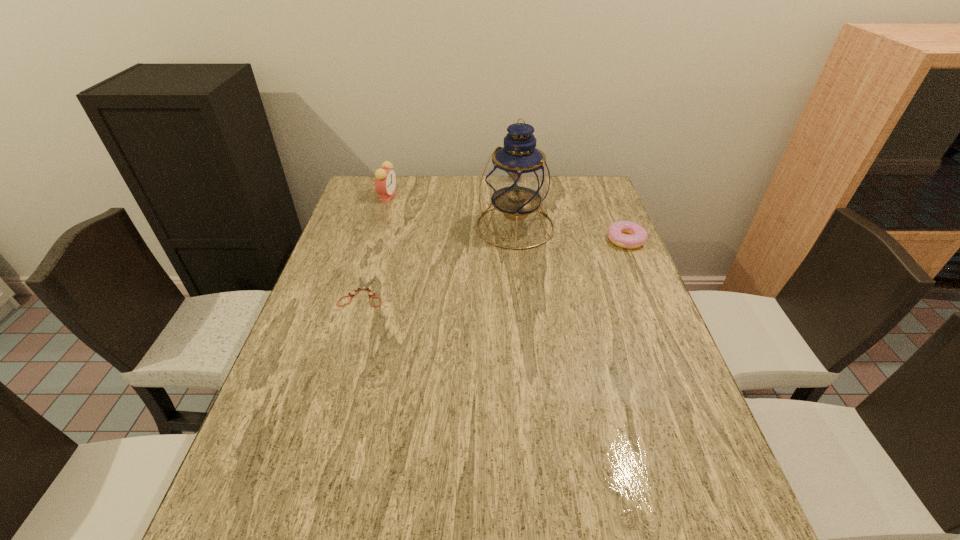
At what (x,y) coordinates should I click in order to perform the action: click on free spot between the rightmost object and the nearest object. Please return your answer as a coordinate pair (x, y). This screenshot has width=960, height=540. Looking at the image, I should click on 494,266.

The height and width of the screenshot is (540, 960). In order to click on vacant region between the nearest object and the third object from left to right in this screenshot , I will do `click(439, 259)`.

You are a GUI agent. You are given a task and a screenshot of the screen. Output one action in this format:
    pyautogui.click(x=<x>, y=<y>)
    Task: Click on the empty location between the shortest object and the doughnut
    The image size is (960, 540).
    Given the screenshot: What is the action you would take?
    pyautogui.click(x=494, y=266)

Where is `vacant area that lies between the third object from left to right and the farthest object`? vacant area that lies between the third object from left to right and the farthest object is located at coordinates (451, 211).

This screenshot has width=960, height=540. I want to click on vacant region between the lantern and the nearest object, so click(439, 259).

Identify which object is the nearest to the second shortest object. Please provide its 2D coordinates. Your answer should be formatted as a tuple, i.e. [(x, y)], where the tuple contains the x and y coordinates of a point satisfying the conditions above.

[(518, 178)]

You are a GUI agent. You are given a task and a screenshot of the screen. Output one action in this format:
    pyautogui.click(x=<x>, y=<y>)
    Task: Click on the object that ranks as the closest to the alarm clock
    
    Given the screenshot: What is the action you would take?
    pyautogui.click(x=518, y=178)

I want to click on vacant region that satisfies the following two spatial constraints: 1. on the front side of the doughnut; 2. on the left side of the tallest object, so [516, 240].

Image resolution: width=960 pixels, height=540 pixels. In order to click on vacant space that satisfies the following two spatial constraints: 1. on the back side of the shortest object; 2. on the right side of the doughnut in this screenshot , I will do `click(378, 240)`.

Where is `free region that satisfies the following two spatial constraints: 1. on the back side of the doughnut; 2. on the left side of the shortest object`? Image resolution: width=960 pixels, height=540 pixels. free region that satisfies the following two spatial constraints: 1. on the back side of the doughnut; 2. on the left side of the shortest object is located at coordinates (378, 240).